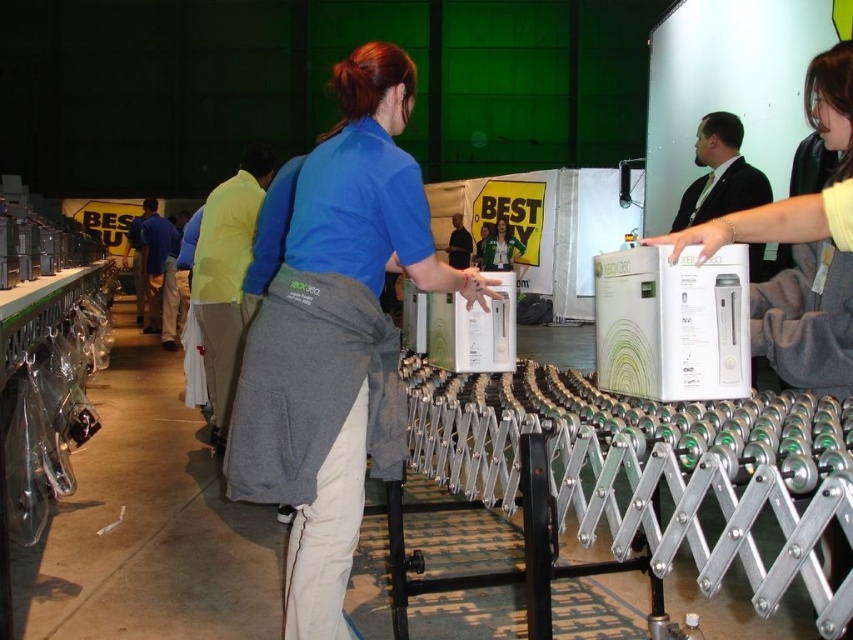
In the scene shown: Is blue fabric shirt at center bigger than green fabric jacket at center?

Incorrect, blue fabric shirt at center is not larger than green fabric jacket at center.

Is blue fabric shirt at center closer to camera compared to green fabric jacket at center?

Yes, it is.

Does point (337, 608) come in front of point (502, 253)?

Yes, point (337, 608) is closer to viewer.

Image resolution: width=853 pixels, height=640 pixels. Identify the location of blue fabric shirt at center. (335, 337).